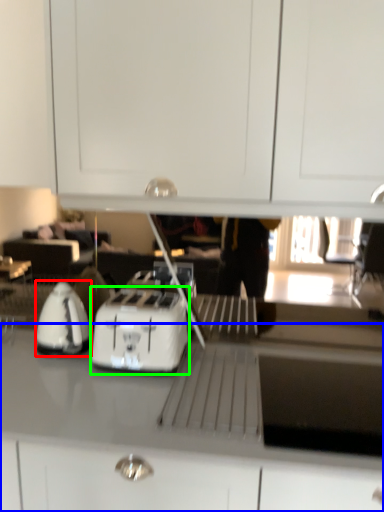
Question: Based on their relative distances, which object is farther from home appliance (highlighted by a red box)? Choose from countertop (highlighted by a blue box) and kitchen appliance (highlighted by a green box).

Choices:
 (A) countertop
 (B) kitchen appliance

Answer: (A)